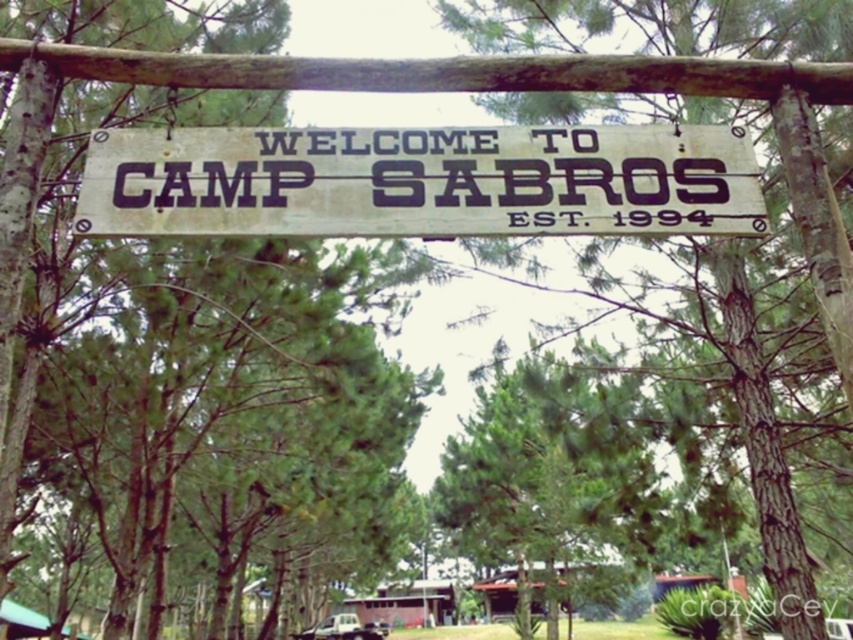
You are standing in front of the Camp Sabros sign and want to take a photo of both the green leafy tree at center and the rusty wood sign at center. Which object should you focus on first if you want to capture both in the same frame without moving the camera?

The green leafy tree at center is located below the rusty wood sign at center, so you should focus on the rusty wood sign at center first to ensure both are in the frame.

You are a hiker who just arrived at Camp Sabros. You notice the rusty wood sign at center and the brown rough bark tree at center. Which object is positioned higher up in the image?

The brown rough bark tree at center is positioned higher up in the image because the rusty wood sign at center is located below it.

From the picture: You are a park ranger who needs to install a new birdhouse on the tallest object in the scene. Which object should you choose between the green leafy tree at center and the rusty wood sign at center?

The green leafy tree at center is taller than the rusty wood sign at center, so you should install the birdhouse on the green leafy tree at center.